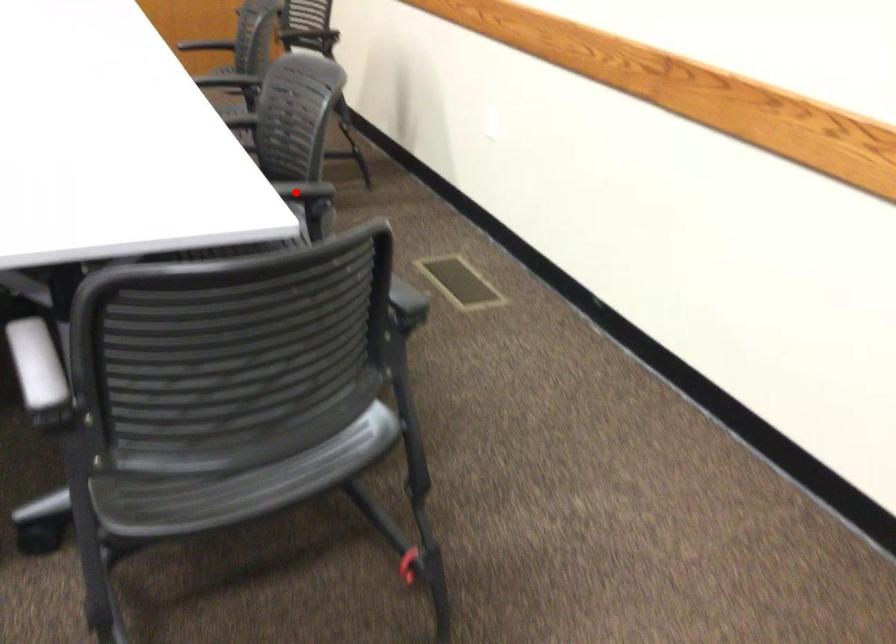
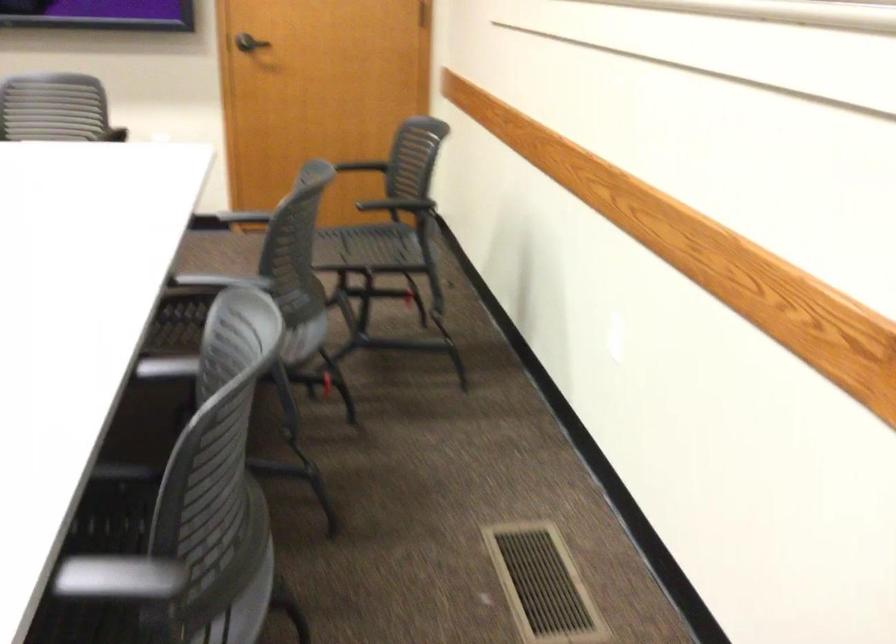
Question: I am providing you with two images of the same scene from different viewpoints. A red point is shown in image1. For the corresponding object point in image2, is it positioned nearer or farther from the camera?

Choices:
 (A) Nearer
 (B) Farther

Answer: (A)